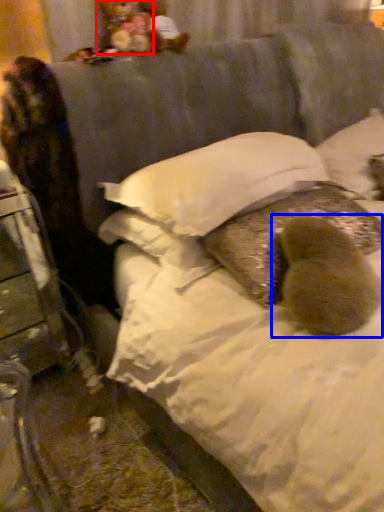
Question: Which object is closer to the camera taking this photo, figurine (highlighted by a red box) or animal (highlighted by a blue box)?

Choices:
 (A) figurine
 (B) animal

Answer: (B)